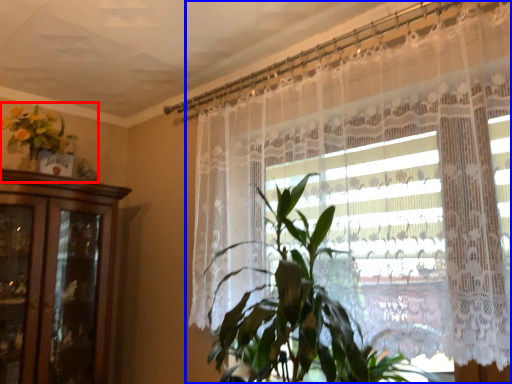
Question: Among these objects, which one is nearest to the camera, floral arrangement (highlighted by a red box) or curtain (highlighted by a blue box)?

Choices:
 (A) floral arrangement
 (B) curtain

Answer: (B)